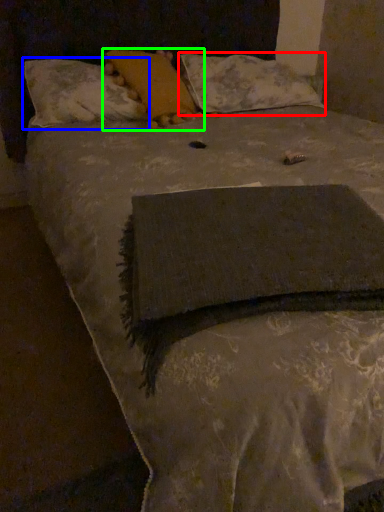
Question: Which object is the farthest from pillow (highlighted by a red box)? Choose among these: pillow (highlighted by a blue box) or pillow (highlighted by a green box).

Choices:
 (A) pillow
 (B) pillow

Answer: (A)